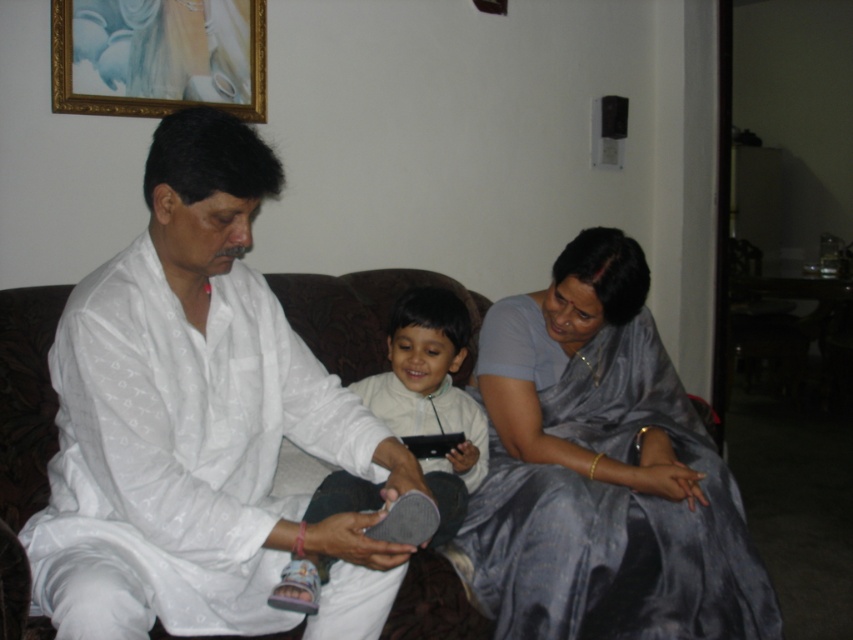
Where is `silky blue saree at lower right`? silky blue saree at lower right is located at coordinates (601, 472).

Is silky blue saree at lower right taller than white matte sandal at center?

Correct, silky blue saree at lower right is much taller as white matte sandal at center.

At what (x,y) coordinates should I click in order to perform the action: click on silky blue saree at lower right. Please return your answer as a coordinate pair (x, y). This screenshot has width=853, height=640. Looking at the image, I should click on (601, 472).

Is white cotton kurta at center wider than white matte sandal at center?

Yes, white cotton kurta at center is wider than white matte sandal at center.

Is white cotton kurta at center smaller than white matte sandal at center?

No.

Locate an element on the screen. The width and height of the screenshot is (853, 640). white cotton kurta at center is located at coordinates (199, 422).

The width and height of the screenshot is (853, 640). Identify the location of white cotton kurta at center. 199,422.

Is white cotton kurta at center wider than silky blue saree at lower right?

No, white cotton kurta at center is not wider than silky blue saree at lower right.

Is point (213, 416) closer to camera compared to point (636, 300)?

Yes.

Find the location of a particular element. white cotton kurta at center is located at coordinates (199, 422).